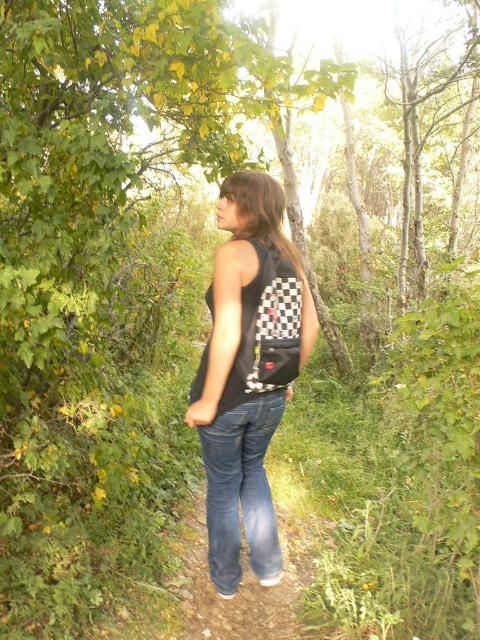
Question: Is black checkered backpack at center above denim at center?

Choices:
 (A) no
 (B) yes

Answer: (B)

Question: Is black checkered backpack at center bigger than denim at center?

Choices:
 (A) no
 (B) yes

Answer: (B)

Question: Estimate the real-world distances between objects in this image. Which object is farther from the denim at center?

Choices:
 (A) checkered fabric backpack at center
 (B) black checkered backpack at center

Answer: (A)

Question: Which object appears farthest from the camera in this image?

Choices:
 (A) black checkered backpack at center
 (B) denim at center

Answer: (B)

Question: Can you confirm if denim at center is positioned below checkered fabric backpack at center?

Choices:
 (A) yes
 (B) no

Answer: (A)

Question: Which of the following is the closest to the observer?

Choices:
 (A) denim at center
 (B) checkered fabric backpack at center
 (C) black checkered backpack at center

Answer: (C)